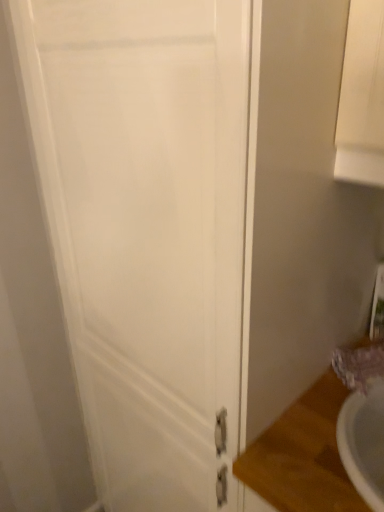
Question: Is white matte door at center not inside matte purple faucet at lower right?

Choices:
 (A) yes
 (B) no

Answer: (A)

Question: From a real-world perspective, is white matte door at center physically below matte purple faucet at lower right?

Choices:
 (A) no
 (B) yes

Answer: (B)

Question: Is white matte door at center beside matte purple faucet at lower right?

Choices:
 (A) no
 (B) yes

Answer: (A)

Question: Can you confirm if white matte door at center is bigger than matte purple faucet at lower right?

Choices:
 (A) no
 (B) yes

Answer: (B)

Question: Are white matte door at center and matte purple faucet at lower right located far from each other?

Choices:
 (A) yes
 (B) no

Answer: (B)

Question: From their relative heights in the image, would you say matte purple faucet at lower right is taller or shorter than wooden counter top at lower right?

Choices:
 (A) tall
 (B) short

Answer: (B)

Question: From a real-world perspective, is matte purple faucet at lower right above or below wooden counter top at lower right?

Choices:
 (A) above
 (B) below

Answer: (A)

Question: Which is correct: matte purple faucet at lower right is inside wooden counter top at lower right, or outside of it?

Choices:
 (A) inside
 (B) outside

Answer: (B)

Question: Considering the positions of matte purple faucet at lower right and wooden counter top at lower right in the image, is matte purple faucet at lower right wider or thinner than wooden counter top at lower right?

Choices:
 (A) thin
 (B) wide

Answer: (A)

Question: Does point (102, 74) appear closer or farther from the camera than point (281, 462)?

Choices:
 (A) closer
 (B) farther

Answer: (A)

Question: Is white matte door at center in front of or behind wooden counter top at lower right in the image?

Choices:
 (A) behind
 (B) front

Answer: (B)

Question: Based on their sizes in the image, would you say white matte door at center is bigger or smaller than wooden counter top at lower right?

Choices:
 (A) big
 (B) small

Answer: (A)

Question: Choose the correct answer: Is white matte door at center inside wooden counter top at lower right or outside it?

Choices:
 (A) outside
 (B) inside

Answer: (A)

Question: Considering the relative positions of white matte door at center and matte purple faucet at lower right in the image provided, is white matte door at center to the left or to the right of matte purple faucet at lower right?

Choices:
 (A) left
 (B) right

Answer: (A)

Question: Is white matte door at center inside or outside of matte purple faucet at lower right?

Choices:
 (A) inside
 (B) outside

Answer: (B)